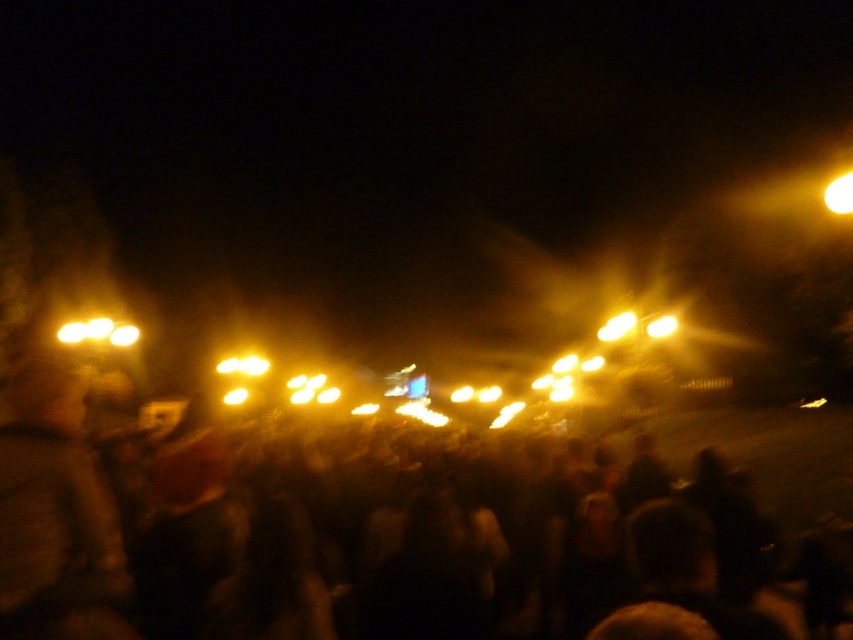
Between matte yellow lights at left and matte yellow light at upper right, which one has less height?

With less height is matte yellow lights at left.

Is matte yellow lights at left taller than matte yellow light at upper right?

No, matte yellow lights at left is not taller than matte yellow light at upper right.

Which is in front, point (91, 333) or point (614, 339)?

Point (91, 333) is more forward.

This screenshot has width=853, height=640. In order to click on matte yellow lights at left in this screenshot , I will do `click(97, 332)`.

Can you confirm if yellow matte light at upper right is smaller than yellow frosted bulb at upper right?

Yes, yellow matte light at upper right is smaller than yellow frosted bulb at upper right.

You are a GUI agent. You are given a task and a screenshot of the screen. Output one action in this format:
    pyautogui.click(x=<x>, y=<y>)
    Task: Click on the yellow matte light at upper right
    The image size is (853, 640).
    Given the screenshot: What is the action you would take?
    pyautogui.click(x=839, y=195)

This screenshot has width=853, height=640. What do you see at coordinates (839, 195) in the screenshot?
I see `yellow matte light at upper right` at bounding box center [839, 195].

Does yellow matte light at upper right have a lesser height compared to matte yellow light at upper right?

Yes.

Which is in front, point (840, 179) or point (628, 330)?

Point (840, 179)

Where is `yellow matte light at upper right`? yellow matte light at upper right is located at coordinates (839, 195).